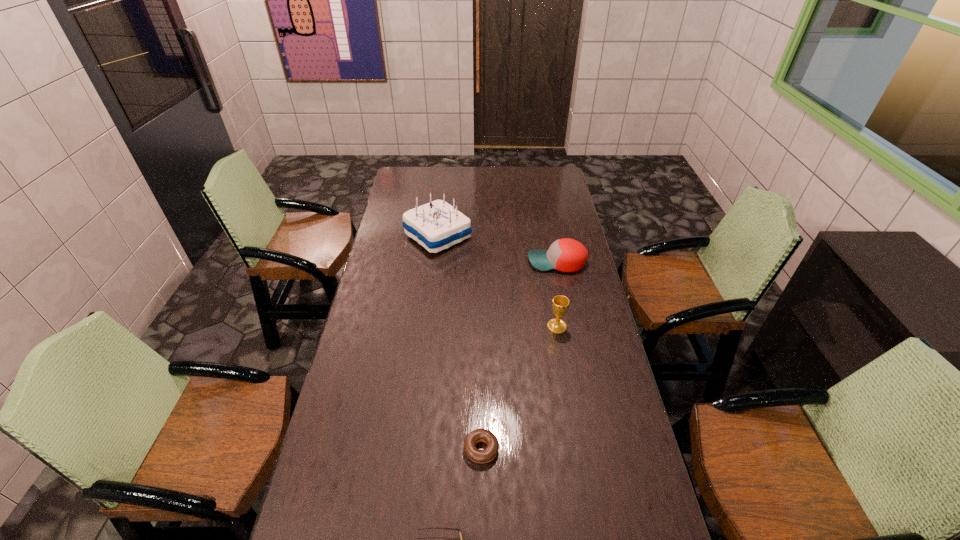
This screenshot has width=960, height=540. Find the location of `birthday cake`. birthday cake is located at coordinates (437, 225).

Identify the location of the fourth shortest object. (560, 303).

I want to click on chalice, so click(x=560, y=303).

Identify the location of baseball cap. This screenshot has width=960, height=540. (566, 255).

At what (x,y) coordinates should I click in order to perform the action: click on the second nearest object. Please return your answer as a coordinate pair (x, y). This screenshot has width=960, height=540. Looking at the image, I should click on point(489,453).

Find the location of `the fourth tallest object`. the fourth tallest object is located at coordinates pos(489,453).

What are the coordinates of `vacant space located on the right of the tallest object` in the screenshot? It's located at (526, 236).

Locate an element on the screen. free region located on the left of the chalice is located at coordinates (500, 327).

This screenshot has width=960, height=540. Find the location of `free spot located 0.340m at the brim of the baseball cap`. free spot located 0.340m at the brim of the baseball cap is located at coordinates (446, 262).

Where is `free region located 0.240m at the brim of the baseball cap`? This screenshot has height=540, width=960. free region located 0.240m at the brim of the baseball cap is located at coordinates (470, 262).